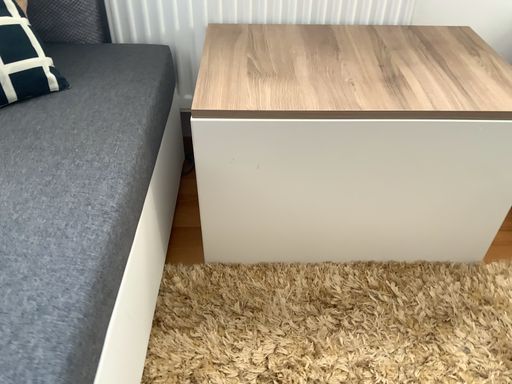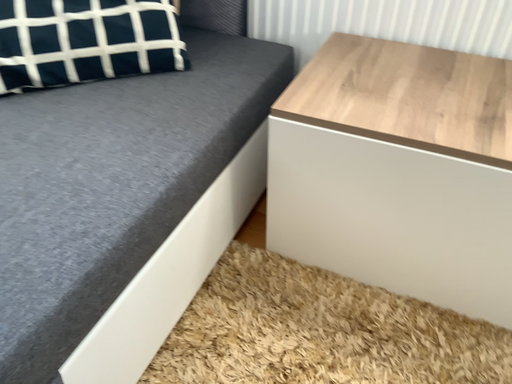
Question: How did the camera likely rotate when shooting the video?

Choices:
 (A) rotated left
 (B) rotated right

Answer: (A)